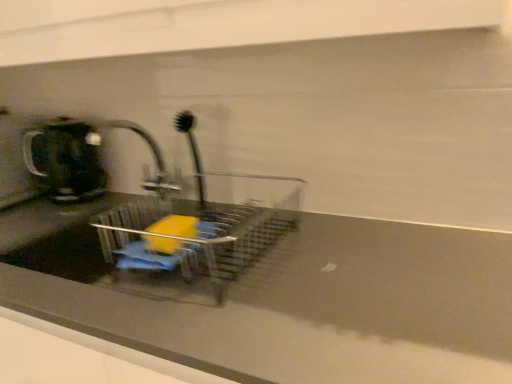
The width and height of the screenshot is (512, 384). In order to click on matte black coffeepot at left in this screenshot , I will do `click(66, 161)`.

Describe the element at coordinates (284, 299) in the screenshot. Image resolution: width=512 pixels, height=384 pixels. I see `matte gray counter top at center` at that location.

What do you see at coordinates (192, 151) in the screenshot? I see `black plastic brush at center` at bounding box center [192, 151].

This screenshot has width=512, height=384. I want to click on clear plastic sink at center, so click(136, 220).

I want to click on matte black coffeepot at left, so click(x=66, y=161).

Is there a large distance between black plastic brush at center and brushed metal tap at center?

No, black plastic brush at center is not far away from brushed metal tap at center.

Find the location of a particular element. The width and height of the screenshot is (512, 384). tap below the black plastic brush at center (from a real-world perspective) is located at coordinates (150, 150).

Between black plastic brush at center and brushed metal tap at center, which one has more height?

With more height is black plastic brush at center.

Are matte gray counter top at center and matte black coffeepot at left making contact?

They are not placed beside each other.

Is matte gray counter top at center bigger or smaller than matte black coffeepot at left?

Considering their sizes, matte gray counter top at center takes up more space than matte black coffeepot at left.

Is matte gray counter top at center to the left of matte black coffeepot at left from the viewer's perspective?

No.

Is the depth of matte gray counter top at center less than that of matte black coffeepot at left?

Yes, matte gray counter top at center is in front of matte black coffeepot at left.

From the picture: Is brushed metal tap at center outside of clear plastic sink at center?

brushed metal tap at center lies outside clear plastic sink at center's area.

Does point (91, 138) appear closer or farther from the camera than point (133, 277)?

Point (91, 138) is positioned farther from the camera compared to point (133, 277).

Which is more to the left, brushed metal tap at center or clear plastic sink at center?

brushed metal tap at center.

Is black plastic brush at center wider than matte gray counter top at center?

In fact, black plastic brush at center might be narrower than matte gray counter top at center.

From the image's perspective, which is above, black plastic brush at center or matte gray counter top at center?

black plastic brush at center, from the image's perspective.

Is the depth of black plastic brush at center greater than that of matte gray counter top at center?

Yes, black plastic brush at center is further from the viewer.

Which of these two, black plastic brush at center or matte gray counter top at center, is bigger?

matte gray counter top at center.

Consider the image. Is matte gray counter top at center taller or shorter than brushed metal tap at center?

Clearly, matte gray counter top at center is taller compared to brushed metal tap at center.

You are a GUI agent. You are given a task and a screenshot of the screen. Output one action in this format:
    pyautogui.click(x=<x>, y=<y>)
    Task: Click on the tap behind the matte gray counter top at center
    
    Given the screenshot: What is the action you would take?
    pyautogui.click(x=150, y=150)

Looking at this image, does matte gray counter top at center have a smaller size compared to brushed metal tap at center?

Incorrect, matte gray counter top at center is not smaller in size than brushed metal tap at center.

Is matte gray counter top at center positioned with its back to brushed metal tap at center?

That's not correct — matte gray counter top at center is not looking away from brushed metal tap at center.

Based on the photo, can you confirm if brushed metal tap at center is wider than matte gray counter top at center?

In fact, brushed metal tap at center might be narrower than matte gray counter top at center.

Is brushed metal tap at center at the left side of matte gray counter top at center?

In fact, brushed metal tap at center is to the right of matte gray counter top at center.

From a real-world perspective, is brushed metal tap at center beneath matte gray counter top at center?

No, from a real-world perspective, brushed metal tap at center is not below matte gray counter top at center.

Considering the sizes of objects brushed metal tap at center and black plastic brush at center in the image provided, who is wider, brushed metal tap at center or black plastic brush at center?

brushed metal tap at center.

Identify the location of brush behind the brushed metal tap at center. Image resolution: width=512 pixels, height=384 pixels. click(x=192, y=151).

Is brushed metal tap at center positioned with its back to black plastic brush at center?

No, brushed metal tap at center is not facing away from black plastic brush at center.

Where is `brush on the right of brushed metal tap at center`? This screenshot has width=512, height=384. brush on the right of brushed metal tap at center is located at coordinates (192, 151).

Identify the location of coffeepot lying behind the matte gray counter top at center. (66, 161).

Based on their spatial positions, is matte gray counter top at center or matte black coffeepot at left closer to brushed metal tap at center?

Based on the image, matte black coffeepot at left appears to be nearer to brushed metal tap at center.

When comparing their distances from black plastic brush at center, does brushed metal tap at center or matte gray counter top at center seem further?

matte gray counter top at center is positioned further to the anchor black plastic brush at center.

From the picture: Which object lies further to the anchor point matte black coffeepot at left, matte gray counter top at center or black plastic brush at center?

matte gray counter top at center lies further to matte black coffeepot at left than the other object.

When comparing their distances from matte black coffeepot at left, does clear plastic sink at center or matte gray counter top at center seem further?

Among the two, matte gray counter top at center is located further to matte black coffeepot at left.

Looking at this image, estimate the real-world distances between objects in this image. Which object is closer to black plastic brush at center, brushed metal tap at center or matte black coffeepot at left?

brushed metal tap at center is closer to black plastic brush at center.

Looking at the image, which one is located closer to matte black coffeepot at left, black plastic brush at center or brushed metal tap at center?

brushed metal tap at center is closer to matte black coffeepot at left.

Looking at the image, which one is located closer to black plastic brush at center, matte gray counter top at center or brushed metal tap at center?

brushed metal tap at center is closer to black plastic brush at center.

From the image, which object appears to be nearer to matte gray counter top at center, matte black coffeepot at left or brushed metal tap at center?

brushed metal tap at center.

Identify the location of tap between clear plastic sink at center and matte black coffeepot at left in the front-back direction. (150, 150).

Find the location of a particular element. tap situated between matte black coffeepot at left and black plastic brush at center from left to right is located at coordinates (150, 150).

Find the location of `sink between matte gray counter top at center and black plastic brush at center from front to back`. sink between matte gray counter top at center and black plastic brush at center from front to back is located at coordinates (136, 220).

Locate an element on the screen. sink between brushed metal tap at center and matte gray counter top at center vertically is located at coordinates (136, 220).